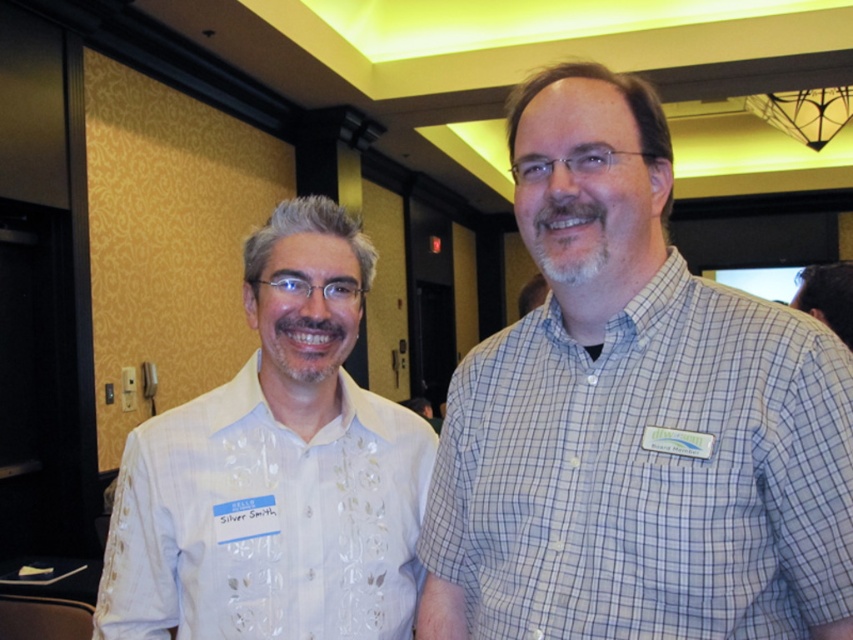
You are standing in the hallway and see both the blue checkered shirt at right and the white embroidered shirt at left. Which shirt is positioned to the right side of the other?

The blue checkered shirt at right is positioned to the right of the white embroidered shirt at left.